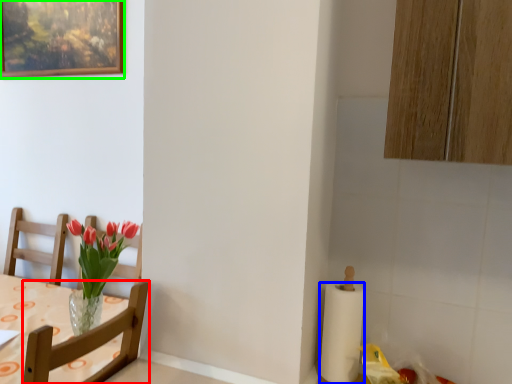
Question: Which object is positioned closest to chair (highlighted by a red box)? Select from paper towel (highlighted by a blue box) and picture frame (highlighted by a green box).

Choices:
 (A) paper towel
 (B) picture frame

Answer: (A)